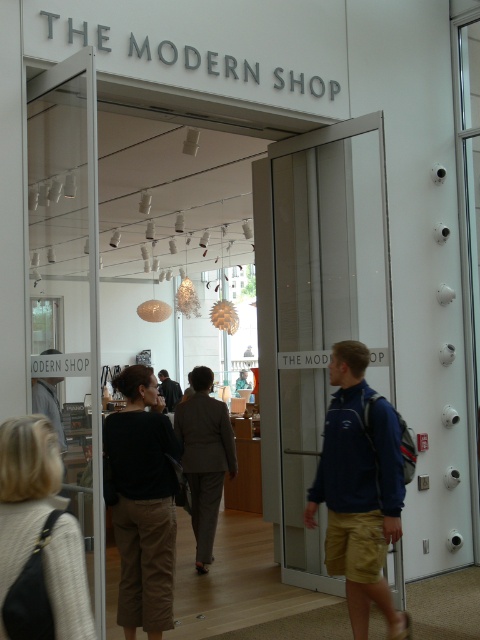
Question: Is light beige sweater at lower left positioned behind gray fabric suit at center?

Choices:
 (A) no
 (B) yes

Answer: (A)

Question: Estimate the real-world distances between objects in this image. Which object is closer to the transparent glass door at center?

Choices:
 (A) blue fabric jacket at center
 (B) dark gray suit at center
 (C) gray fabric suit at center

Answer: (C)

Question: Does black cotton pants at center appear on the left side of gray fabric suit at center?

Choices:
 (A) yes
 (B) no

Answer: (A)

Question: Which object is positioned farthest from the transparent glass door at center?

Choices:
 (A) light beige sweater at lower left
 (B) black cotton pants at center

Answer: (A)

Question: Is black cotton pants at center to the right of gray fabric suit at center from the viewer's perspective?

Choices:
 (A) yes
 (B) no

Answer: (B)

Question: Among these objects, which one is nearest to the camera?

Choices:
 (A) black cotton pants at center
 (B) gray fabric suit at center
 (C) transparent glass door at center

Answer: (A)